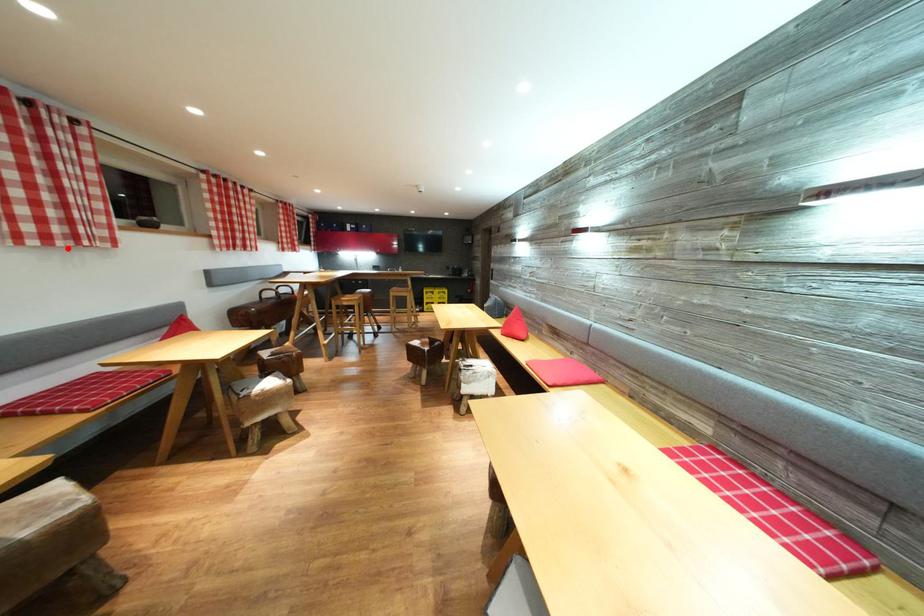
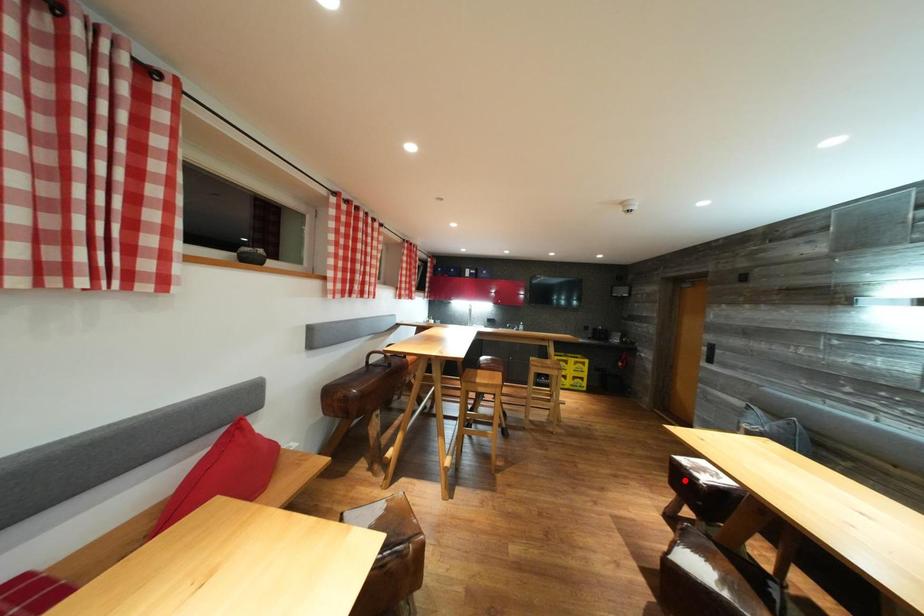
I am providing you with two images of the same scene from different viewpoints. A red point is marked on the first image and another point is marked on the second image. Is the marked point in image1 the same physical position as the marked point in image2?

No